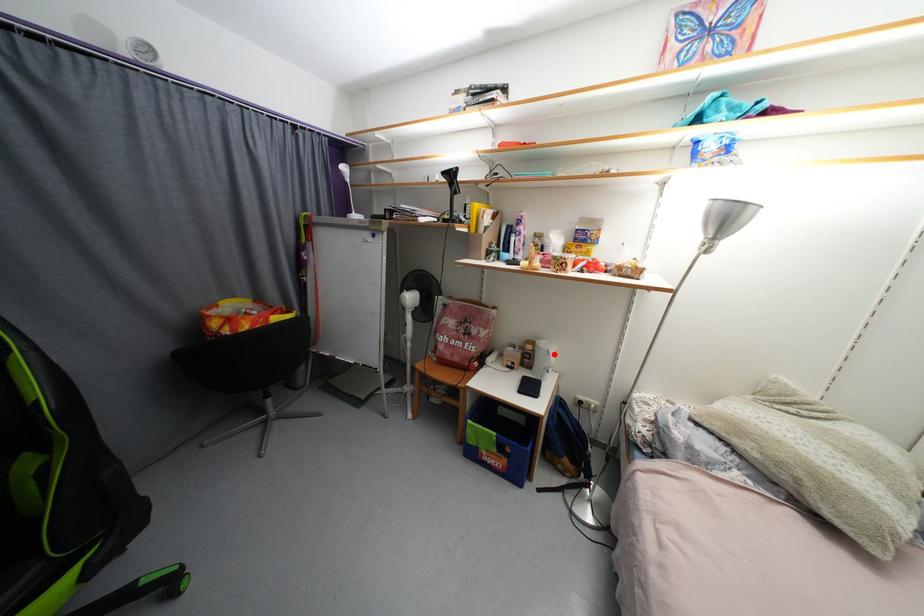
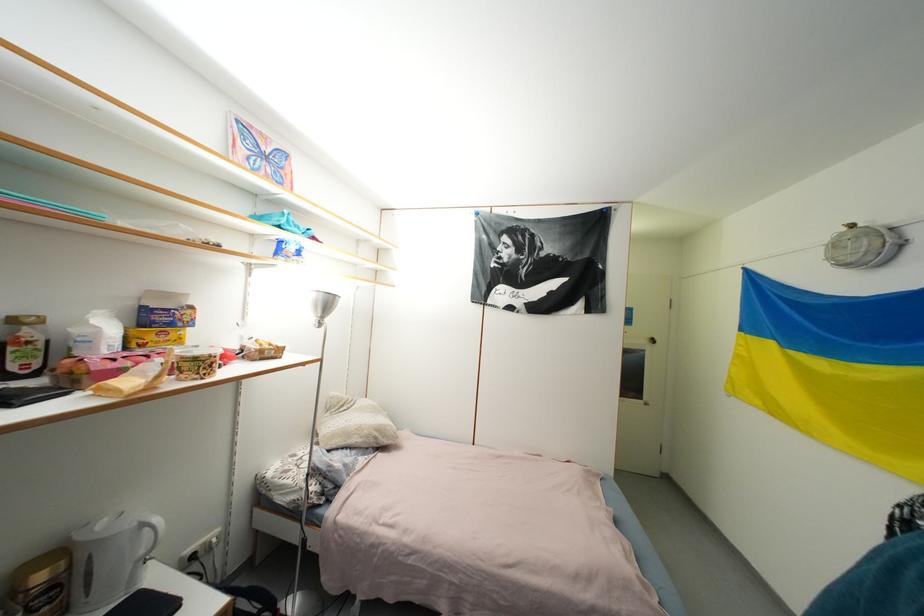
Find the pixel in the second image that matches the highlighted location in the first image.

(149, 528)